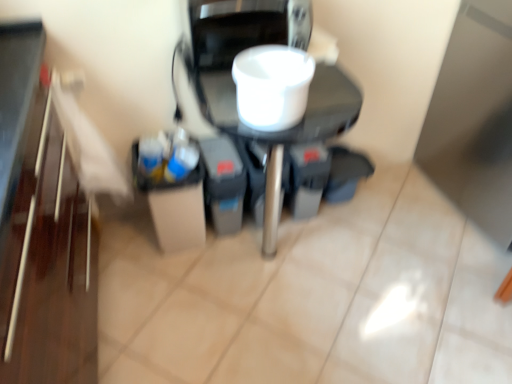
Question: Is white glossy coffee maker at center, which is counted as the 2th appliance, starting from the front, in front of or behind white matte cup at center, positioned as the 2th appliance in back-to-front order, in the image?

Choices:
 (A) front
 (B) behind

Answer: (B)

Question: Considering the positions of white glossy coffee maker at center, which is counted as the 2th appliance, starting from the front, and white matte cup at center, the first appliance viewed from the front, in the image, is white glossy coffee maker at center, which is counted as the 2th appliance, starting from the front, taller or shorter than white matte cup at center, the first appliance viewed from the front,?

Choices:
 (A) short
 (B) tall

Answer: (B)

Question: Based on their positions, is white glossy coffee maker at center, which is the 1th appliance from back to front, located to the left or right of white matte cup at center, the first appliance viewed from the front?

Choices:
 (A) left
 (B) right

Answer: (A)

Question: In terms of width, does white matte cup at center, positioned as the 2th appliance in back-to-front order, look wider or thinner when compared to white glossy coffee maker at center, which is the 1th appliance from back to front?

Choices:
 (A) thin
 (B) wide

Answer: (A)

Question: Looking at the image, does white matte cup at center, positioned as the 2th appliance in back-to-front order, seem bigger or smaller compared to white glossy coffee maker at center, which is counted as the 2th appliance, starting from the front?

Choices:
 (A) big
 (B) small

Answer: (B)

Question: Do you think white matte cup at center, positioned as the 2th appliance in back-to-front order, is within white glossy coffee maker at center, which is counted as the 2th appliance, starting from the front, or outside of it?

Choices:
 (A) inside
 (B) outside

Answer: (B)

Question: From their relative heights in the image, would you say white matte cup at center, the first appliance viewed from the front, is taller or shorter than white glossy coffee maker at center, which is counted as the 2th appliance, starting from the front?

Choices:
 (A) tall
 (B) short

Answer: (B)